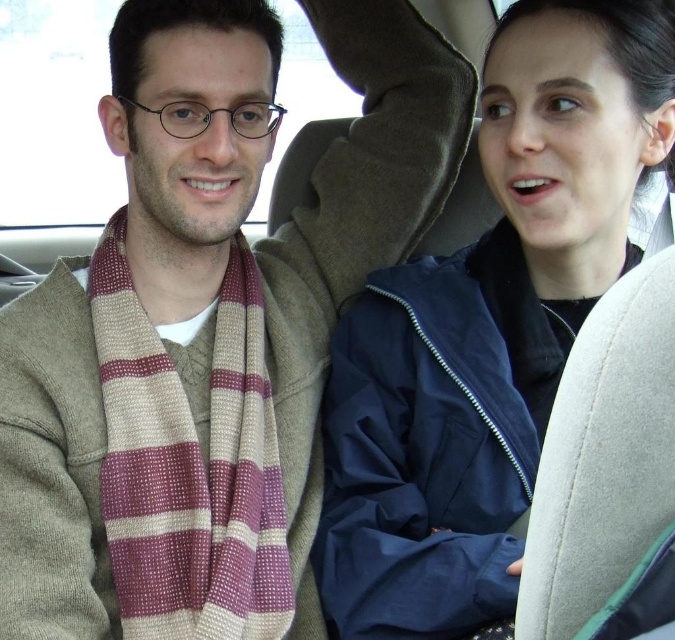
Can you confirm if striped wool scarf at left is shorter than navy blue jacket at upper right?

Incorrect, striped wool scarf at left's height does not fall short of navy blue jacket at upper right's.

Is striped wool scarf at left closer to camera compared to navy blue jacket at upper right?

No, striped wool scarf at left is behind navy blue jacket at upper right.

Does point (55, 369) come behind point (508, 308)?

No, (55, 369) is closer to viewer.

Image resolution: width=675 pixels, height=640 pixels. I want to click on striped wool scarf at left, so click(207, 324).